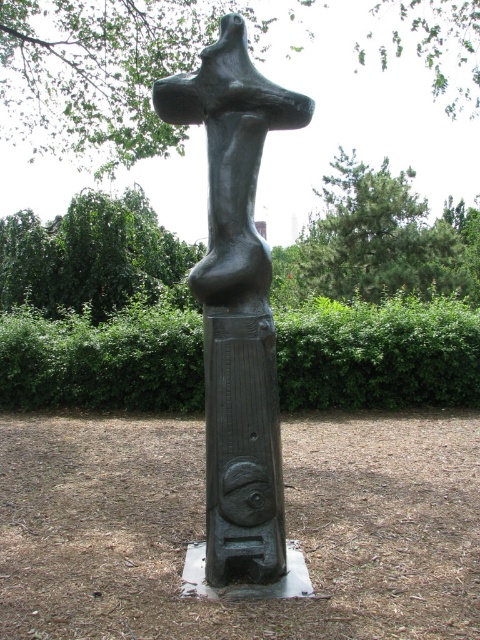
Question: Can you confirm if bronze statue at center is positioned to the right of green polished stone pole at center?

Choices:
 (A) yes
 (B) no

Answer: (B)

Question: Among these objects, which one is farthest from the camera?

Choices:
 (A) green polished stone pole at center
 (B) green leafy hedge at center
 (C) bronze statue at center

Answer: (B)

Question: Does green leafy hedge at center appear on the left side of bronze statue at center?

Choices:
 (A) yes
 (B) no

Answer: (A)

Question: Is bronze statue at center smaller than green polished stone pole at center?

Choices:
 (A) no
 (B) yes

Answer: (A)

Question: Which point appears farthest from the camera in this image?

Choices:
 (A) (21, 317)
 (B) (236, 291)

Answer: (A)

Question: Estimate the real-world distances between objects in this image. Which object is farther from the green leafy hedge at center?

Choices:
 (A) bronze statue at center
 (B) green polished stone pole at center

Answer: (A)